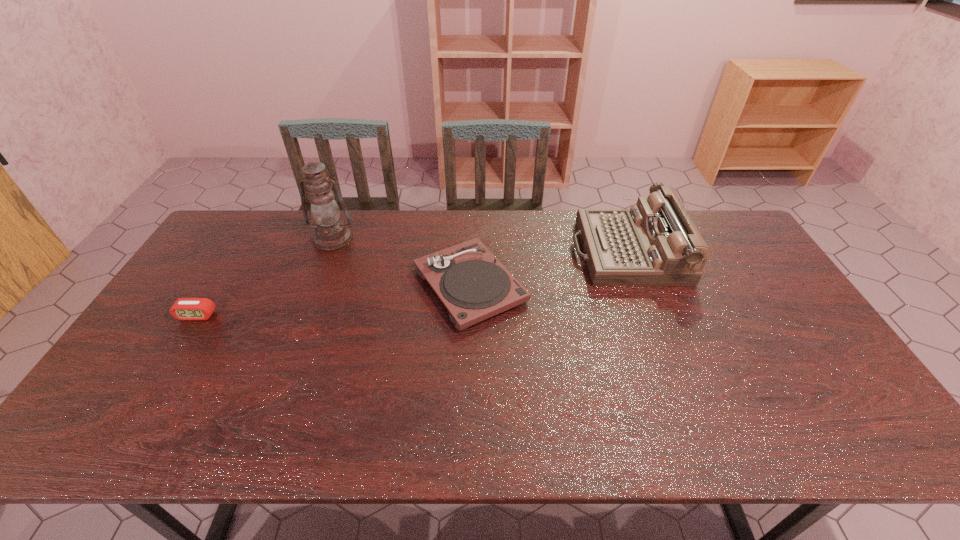
Locate an element on the screen. This screenshot has width=960, height=540. free space between the third tallest object and the rightmost object is located at coordinates (548, 268).

The width and height of the screenshot is (960, 540). Identify the location of the second closest object to the second object from right to left. (331, 233).

You are a GUI agent. You are given a task and a screenshot of the screen. Output one action in this format:
    pyautogui.click(x=<x>, y=<y>)
    Task: Click on the object that can be found as the second closest to the tallest object
    The height and width of the screenshot is (540, 960).
    Given the screenshot: What is the action you would take?
    pyautogui.click(x=183, y=308)

At what (x,y) coordinates should I click in order to perform the action: click on free space that satisfies the following two spatial constraints: 1. on the keyboard of the third shortest object; 2. on the front side of the phonograph_record. Please return your answer as a coordinate pair (x, y). This screenshot has width=960, height=540. Looking at the image, I should click on (639, 285).

At what (x,y) coordinates should I click in order to perform the action: click on free space in the image that satisfies the following two spatial constraints: 1. on the front side of the second object from left to right; 2. on the left side of the phonograph_record. Please return your answer as a coordinate pair (x, y). The image size is (960, 540). Looking at the image, I should click on (315, 285).